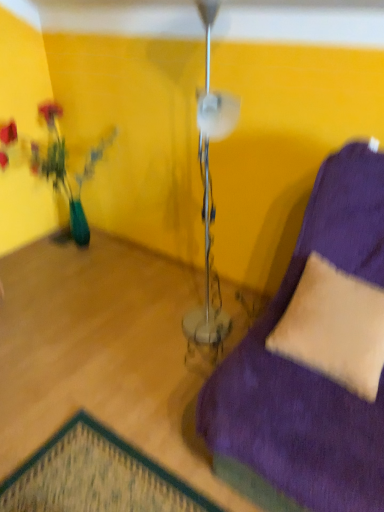
Question: From a real-world perspective, does teal glass vase at left sit lower than beige suede pillow at lower right?

Choices:
 (A) no
 (B) yes

Answer: (B)

Question: From the image's perspective, does teal glass vase at left appear lower than beige suede pillow at lower right?

Choices:
 (A) yes
 (B) no

Answer: (B)

Question: Can you confirm if teal glass vase at left is wider than beige suede pillow at lower right?

Choices:
 (A) yes
 (B) no

Answer: (A)

Question: Is teal glass vase at left to the left of beige suede pillow at lower right from the viewer's perspective?

Choices:
 (A) yes
 (B) no

Answer: (A)

Question: Is teal glass vase at left outside beige suede pillow at lower right?

Choices:
 (A) no
 (B) yes

Answer: (B)

Question: Can you confirm if teal glass vase at left is positioned to the right of beige suede pillow at lower right?

Choices:
 (A) yes
 (B) no

Answer: (B)

Question: Is beige suede pillow at lower right thinner than teal glass vase at left?

Choices:
 (A) no
 (B) yes

Answer: (B)

Question: From a real-world perspective, is beige suede pillow at lower right physically above teal glass vase at left?

Choices:
 (A) no
 (B) yes

Answer: (B)

Question: Is beige suede pillow at lower right shorter than teal glass vase at left?

Choices:
 (A) yes
 (B) no

Answer: (A)

Question: From the image's perspective, is beige suede pillow at lower right above teal glass vase at left?

Choices:
 (A) yes
 (B) no

Answer: (B)

Question: Is beige suede pillow at lower right bigger than teal glass vase at left?

Choices:
 (A) no
 (B) yes

Answer: (A)

Question: From a real-world perspective, does beige suede pillow at lower right sit lower than teal glass vase at left?

Choices:
 (A) yes
 (B) no

Answer: (B)

Question: Relative to beige suede pillow at lower right, is teal glass vase at left in front or behind?

Choices:
 (A) front
 (B) behind

Answer: (B)